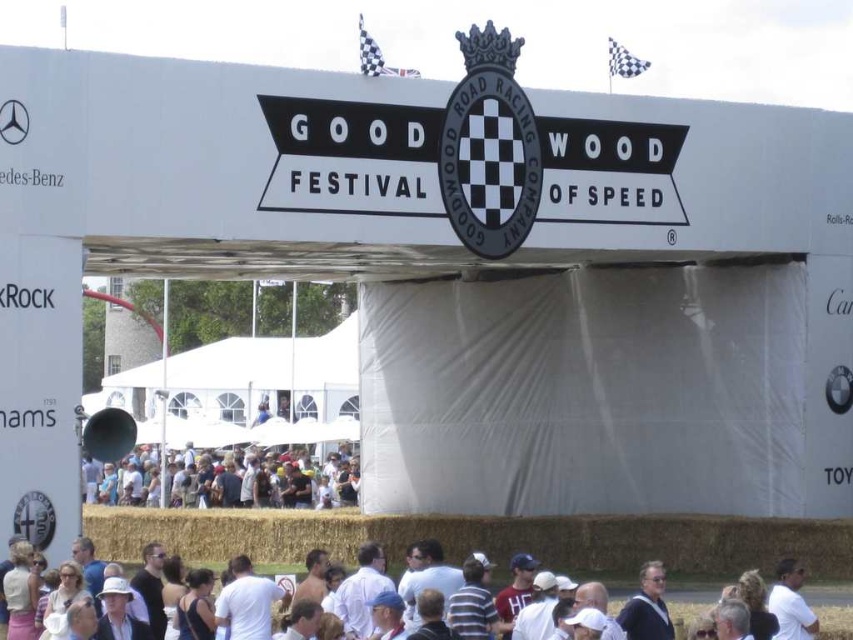
Is white cotton crowd at center wider than white matte shirt at lower right?

Indeed, white cotton crowd at center has a greater width compared to white matte shirt at lower right.

Where is `white cotton crowd at center`? white cotton crowd at center is located at coordinates (289, 481).

The width and height of the screenshot is (853, 640). Identify the location of white cotton crowd at center. (289, 481).

Does white cotton shirt at lower center lie behind white cotton crowd at center?

No, white cotton shirt at lower center is in front of white cotton crowd at center.

Is white cotton shirt at lower center positioned before white cotton crowd at center?

Yes, it is.

Identify the location of white cotton shirt at lower center. Image resolution: width=853 pixels, height=640 pixels. (47, 570).

Where is `white cotton shirt at lower center`? The width and height of the screenshot is (853, 640). white cotton shirt at lower center is located at coordinates (47, 570).

Does point (51, 579) come farther from viewer compared to point (781, 604)?

Yes, point (51, 579) is behind point (781, 604).

Between white cotton shirt at lower center and white matte shirt at lower right, which one appears on the left side from the viewer's perspective?

Positioned to the left is white cotton shirt at lower center.

Is point (335, 580) behind point (780, 593)?

Yes.

Locate an element on the screen. white cotton shirt at lower center is located at coordinates (47, 570).